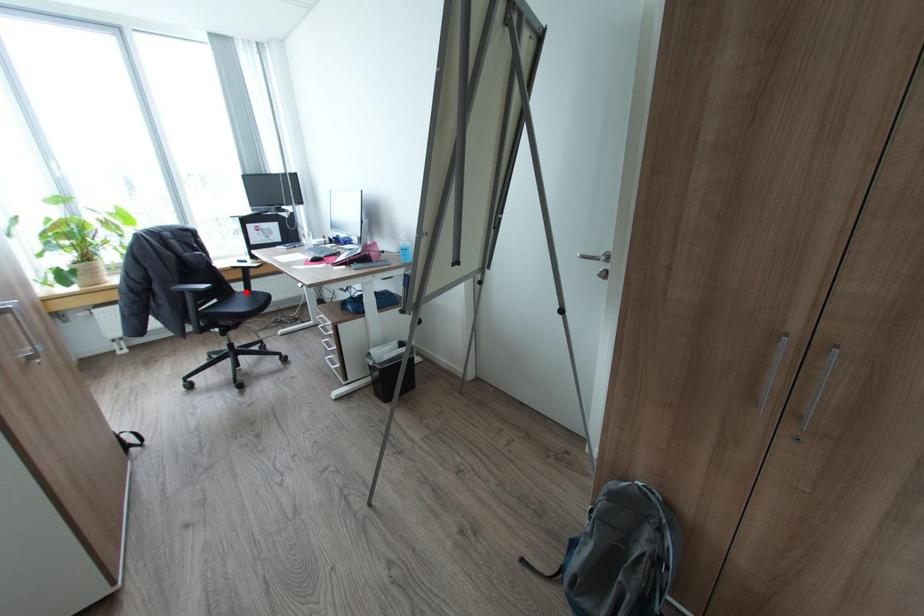
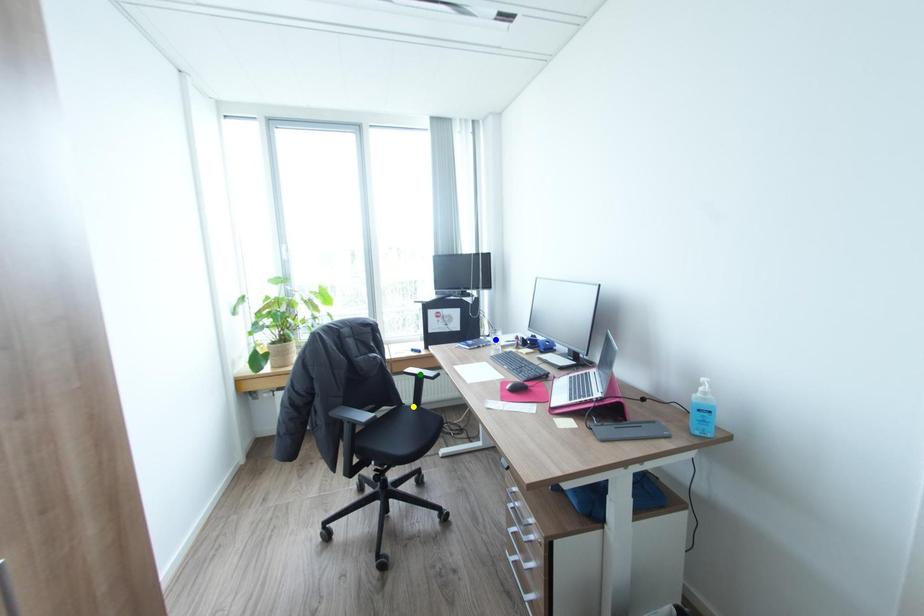
Question: I am providing you with two images of the same scene from different viewpoints. A red point is marked on the first image. You are given multiple points on the second image. Which mark in image 2 goes with the point in image 1?

Choices:
 (A) blue point
 (B) yellow point
 (C) green point

Answer: (B)